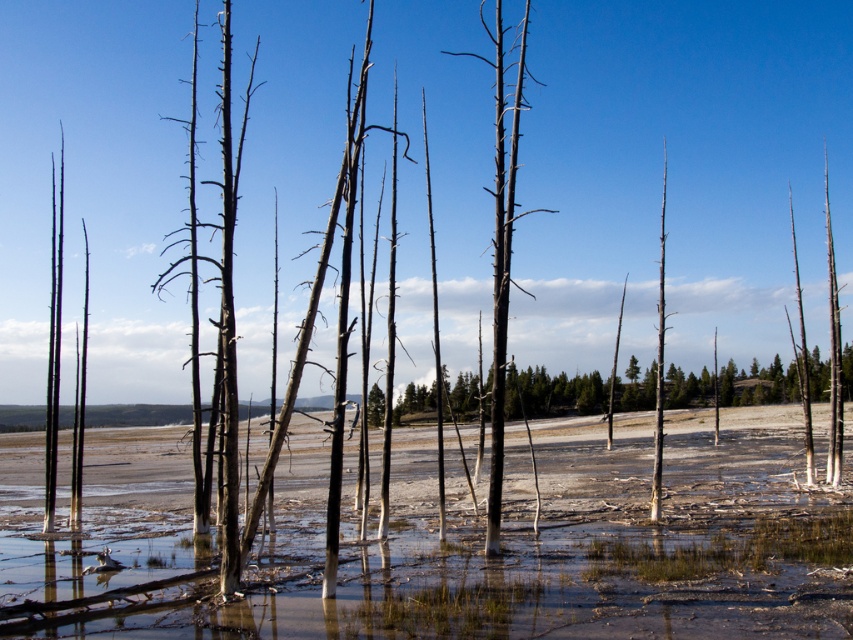
Based on the photo, who is lower down, charcoal textured tree trunk at center or smooth gray tree trunk at center?

Positioned lower is smooth gray tree trunk at center.

Looking at this image, is charcoal textured tree trunk at center thinner than smooth gray tree trunk at center?

Indeed, charcoal textured tree trunk at center has a lesser width compared to smooth gray tree trunk at center.

Locate an element on the screen. The image size is (853, 640). charcoal textured tree trunk at center is located at coordinates (502, 259).